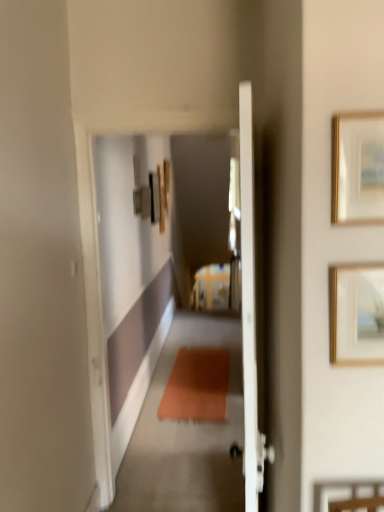
Question: Is gold-framed picture at upper right, the first picture frame when ordered from top to bottom, looking in the opposite direction of gold metallic picture frame at upper right, which ranks as the second picture frame in top-to-bottom order?

Choices:
 (A) yes
 (B) no

Answer: (B)

Question: From the image's perspective, does gold-framed picture at upper right, the first picture frame when ordered from top to bottom, appear higher than gold metallic picture frame at upper right, placed as the first picture frame when sorted from bottom to top?

Choices:
 (A) yes
 (B) no

Answer: (A)

Question: Does gold-framed picture at upper right, which appears as the 2th picture frame when ordered from the bottom, lie behind gold metallic picture frame at upper right, which ranks as the second picture frame in top-to-bottom order?

Choices:
 (A) no
 (B) yes

Answer: (A)

Question: From a real-world perspective, is gold-framed picture at upper right, the first picture frame when ordered from top to bottom, over gold metallic picture frame at upper right, which ranks as the second picture frame in top-to-bottom order?

Choices:
 (A) no
 (B) yes

Answer: (B)

Question: Is gold-framed picture at upper right, which appears as the 2th picture frame when ordered from the bottom, not inside gold metallic picture frame at upper right, placed as the first picture frame when sorted from bottom to top?

Choices:
 (A) yes
 (B) no

Answer: (A)

Question: Is gold-framed picture at upper right, which appears as the 2th picture frame when ordered from the bottom, thinner than gold metallic picture frame at upper right, which ranks as the second picture frame in top-to-bottom order?

Choices:
 (A) yes
 (B) no

Answer: (A)

Question: From a real-world perspective, is gold metallic picture frame at upper right, placed as the first picture frame when sorted from bottom to top, on top of gold-framed picture at upper right, which appears as the 2th picture frame when ordered from the bottom?

Choices:
 (A) no
 (B) yes

Answer: (A)

Question: Can you confirm if gold metallic picture frame at upper right, which ranks as the second picture frame in top-to-bottom order, is bigger than gold-framed picture at upper right, the first picture frame when ordered from top to bottom?

Choices:
 (A) yes
 (B) no

Answer: (A)

Question: Would you say gold metallic picture frame at upper right, which ranks as the second picture frame in top-to-bottom order, is outside gold-framed picture at upper right, the first picture frame when ordered from top to bottom?

Choices:
 (A) yes
 (B) no

Answer: (A)

Question: Is gold metallic picture frame at upper right, placed as the first picture frame when sorted from bottom to top, not near gold-framed picture at upper right, which appears as the 2th picture frame when ordered from the bottom?

Choices:
 (A) yes
 (B) no

Answer: (B)

Question: Is gold metallic picture frame at upper right, placed as the first picture frame when sorted from bottom to top, next to gold-framed picture at upper right, which appears as the 2th picture frame when ordered from the bottom, and touching it?

Choices:
 (A) yes
 (B) no

Answer: (B)

Question: Is gold-framed picture at upper right, which appears as the 2th picture frame when ordered from the bottom, surrounded by gold metallic picture frame at upper right, placed as the first picture frame when sorted from bottom to top?

Choices:
 (A) yes
 (B) no

Answer: (B)

Question: Considering their positions, is gold metallic picture frame at upper right, placed as the first picture frame when sorted from bottom to top, located in front of or behind gold-framed picture at upper right, the first picture frame when ordered from top to bottom?

Choices:
 (A) behind
 (B) front

Answer: (A)